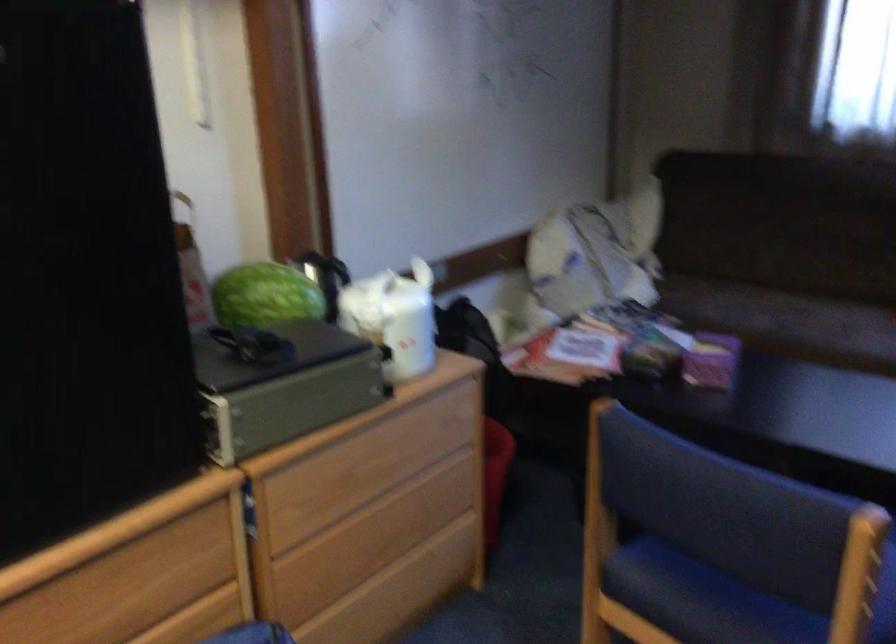
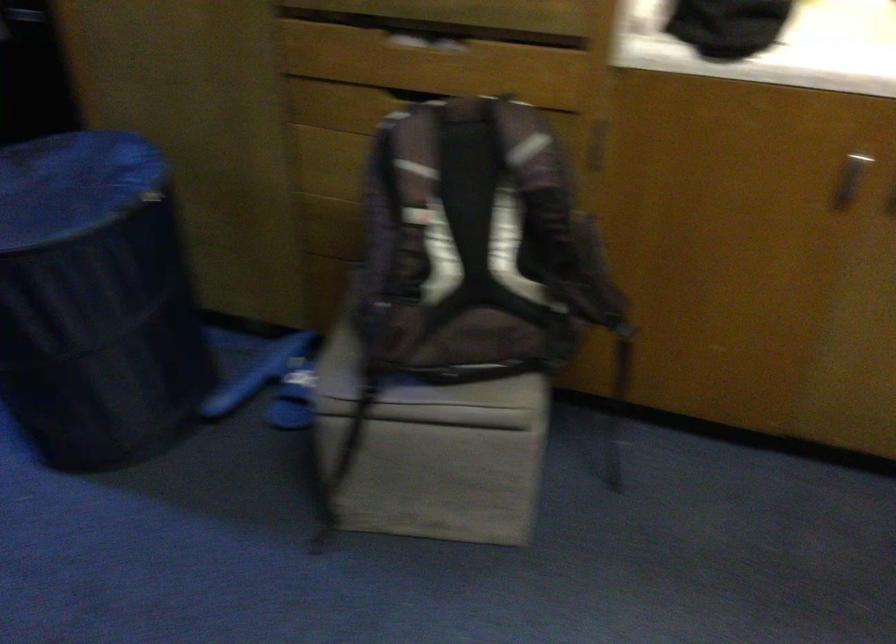
How did the camera likely rotate?

The camera's rotation is toward right-down.